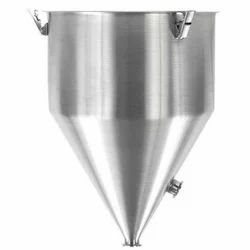
Locate an element on the screen. latches is located at coordinates (36, 19), (186, 22).